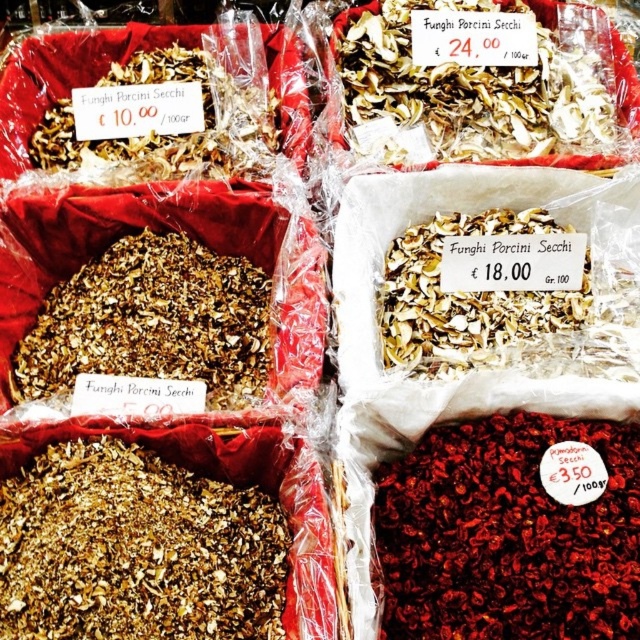
Who is taller, brown crumbly dried mushrooms at center or brown dried mushrooms at upper left?

brown dried mushrooms at upper left

Between point (260, 516) and point (182, 150), which one is positioned in front?

Point (260, 516) is in front.

Is point (8, 612) behind point (148, 115)?

That is False.

Find the location of a particular element. Image resolution: width=640 pixels, height=640 pixels. brown crumbly dried mushrooms at center is located at coordinates (134, 548).

Is dried red berries at lower right positioned behind white dried mushrooms at upper center?

No, it is in front of white dried mushrooms at upper center.

Between dried red berries at lower right and white dried mushrooms at upper center, which one has less height?

dried red berries at lower right

Does point (616, 544) lie in front of point (468, 4)?

Yes.

Image resolution: width=640 pixels, height=640 pixels. Find the location of `dried red berries at lower right`. dried red berries at lower right is located at coordinates (506, 534).

Between dried red berries at lower right and brown crumbly dried mushrooms at center, which one is positioned lower?

brown crumbly dried mushrooms at center is below.

Based on the photo, is dried red berries at lower right above brown crumbly dried mushrooms at center?

Indeed, dried red berries at lower right is positioned over brown crumbly dried mushrooms at center.

The width and height of the screenshot is (640, 640). Find the location of `dried red berries at lower right`. dried red berries at lower right is located at coordinates (506, 534).

The image size is (640, 640). In order to click on dried red berries at lower right in this screenshot , I will do `click(506, 534)`.